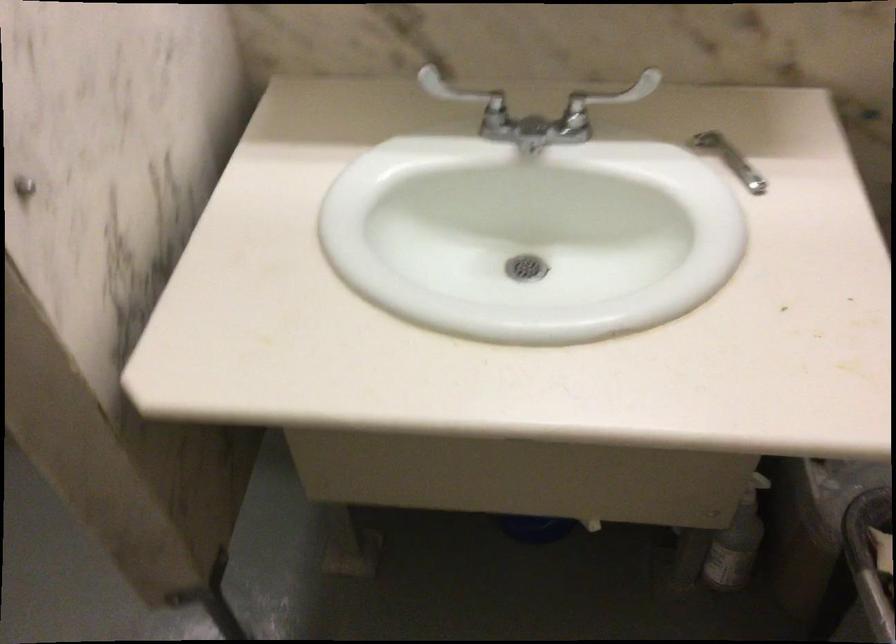
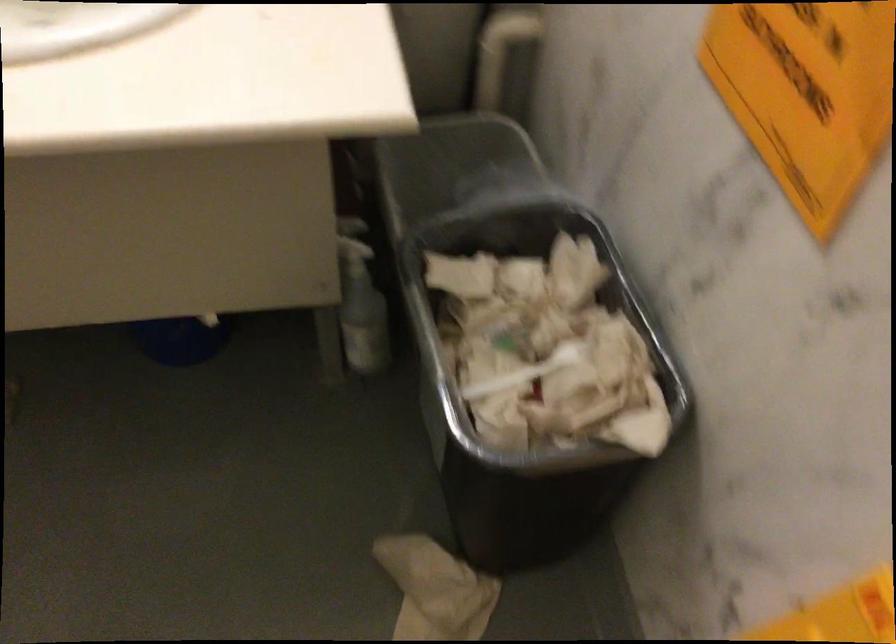
Where in the second image is the point corresponding to pixel 737 526 from the first image?

(360, 303)